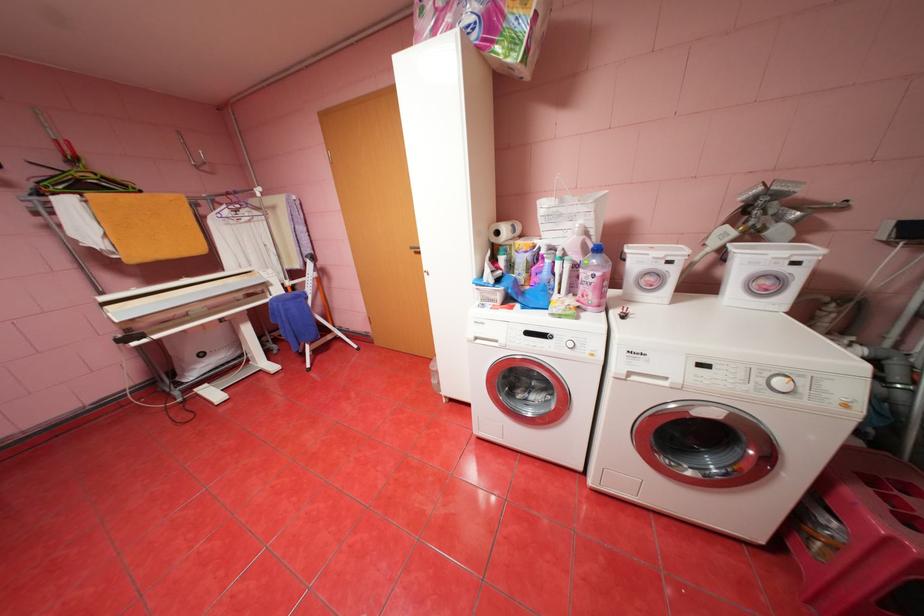
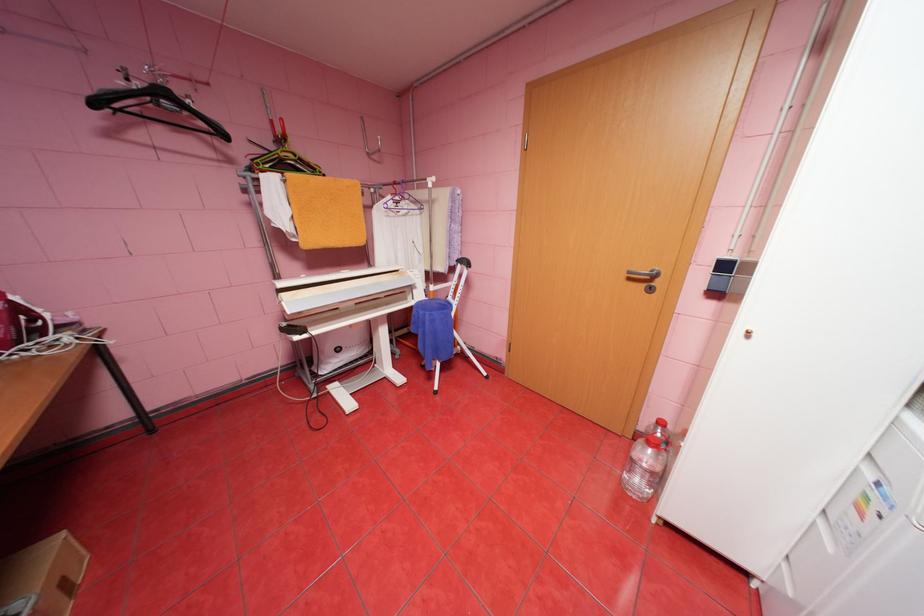
In a continuous first-person perspective shot, in which direction is the camera moving?

The cameraman moved toward left, forward.